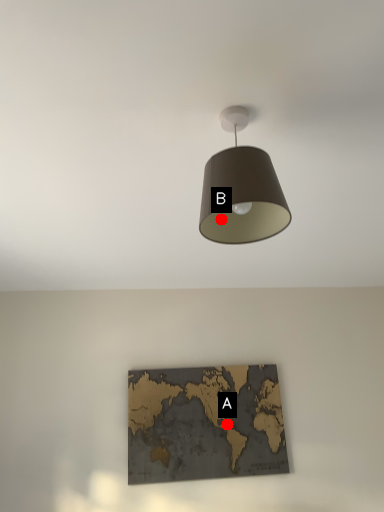
Question: Two points are circled on the image, labeled by A and B beside each circle. Among these points, which one is farthest from the camera?

Choices:
 (A) A is further
 (B) B is further

Answer: (A)